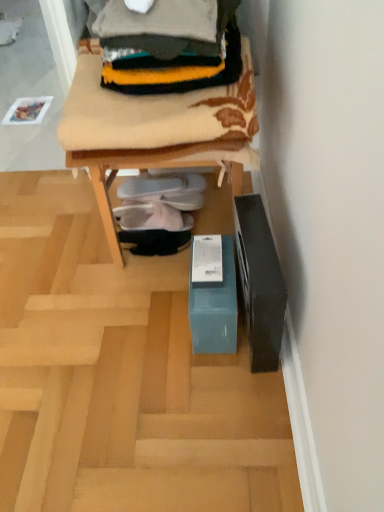
The image size is (384, 512). Find the location of `free spot to the left of black suede shoes at center, the first footwear ordered from the bottom`. free spot to the left of black suede shoes at center, the first footwear ordered from the bottom is located at coordinates [x=93, y=254].